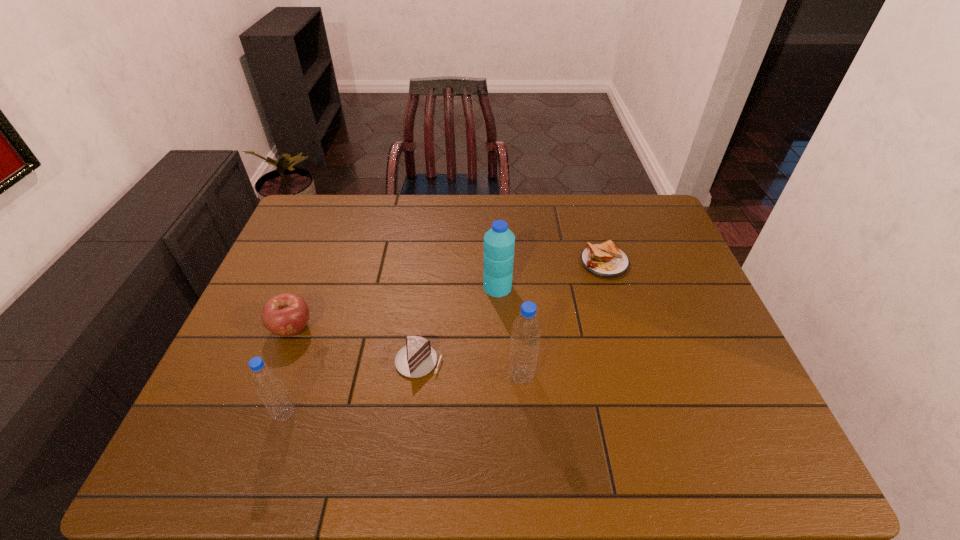
The width and height of the screenshot is (960, 540). Identify the location of the leftmost water bottle. (266, 381).

The width and height of the screenshot is (960, 540). What are the coordinates of `the nearest water bottle` in the screenshot? It's located at (266, 381).

Locate an element on the screen. This screenshot has height=540, width=960. the second nearest water bottle is located at coordinates (526, 330).

This screenshot has width=960, height=540. I want to click on the farthest water bottle, so click(x=499, y=242).

The image size is (960, 540). Find the location of `sandwich`. sandwich is located at coordinates (605, 260).

Where is `the shortest object`? The image size is (960, 540). the shortest object is located at coordinates (605, 260).

This screenshot has width=960, height=540. What are the coordinates of `chocolate cake` in the screenshot? It's located at (416, 359).

You are a GUI agent. You are given a task and a screenshot of the screen. Output one action in this format:
    pyautogui.click(x=<x>, y=<y>)
    Task: Click on the third object from left to right
    
    Given the screenshot: What is the action you would take?
    pyautogui.click(x=416, y=359)

The width and height of the screenshot is (960, 540). In order to click on the third shortest object in this screenshot , I will do `click(287, 314)`.

Image resolution: width=960 pixels, height=540 pixels. In order to click on vacant point located 0.210m on the right of the nearest water bottle in this screenshot , I will do `click(390, 414)`.